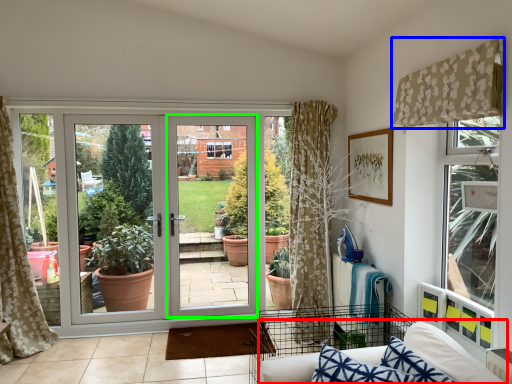
Question: Which object is the farthest from couch (highlighted by a red box)? Choose among these: curtain (highlighted by a blue box) or screen door (highlighted by a green box).

Choices:
 (A) curtain
 (B) screen door

Answer: (B)